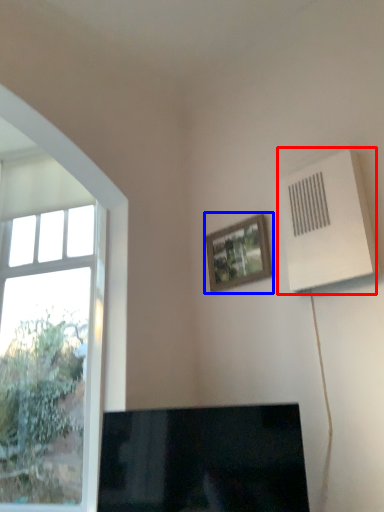
Question: Which point is further to the camera, air conditioning (highlighted by a red box) or picture frame (highlighted by a blue box)?

Choices:
 (A) air conditioning
 (B) picture frame

Answer: (B)